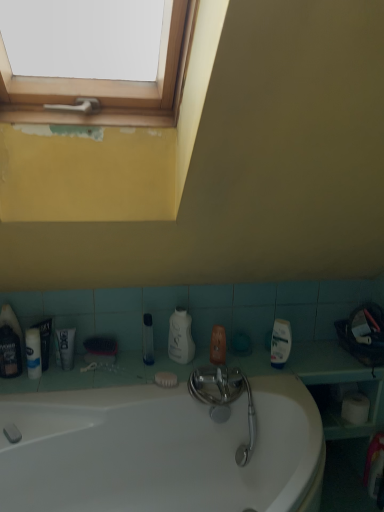
Question: From their relative heights in the image, would you say white matte soap at lower center is taller or shorter than translucent plastic mouthwash at lower left, the first mouthwash in the left-to-right sequence?

Choices:
 (A) short
 (B) tall

Answer: (A)

Question: Is white matte soap at lower center wider or thinner than translucent plastic mouthwash at lower left, marked as the 2th mouthwash in a right-to-left arrangement?

Choices:
 (A) thin
 (B) wide

Answer: (A)

Question: Which object is the closest to the clear plastic bottle at center, which ranks as the second cleaning product in right-to-left order?

Choices:
 (A) white matte soap at lower center
 (B) white matte toothpaste at lower left
 (C) white matte tube at lower left
 (D) white glossy bottle at right, the first cleaning product in the right-to-left sequence
 (E) white glossy bathtub at center

Answer: (A)

Question: Which is farther from the clear plastic tube at center, which is the second mouthwash in left-to-right order?

Choices:
 (A) translucent plastic mouthwash at lower left, marked as the 2th mouthwash in a right-to-left arrangement
 (B) wooden frame at upper left
 (C) white glossy bottle at right, the first cleaning product in the right-to-left sequence
 (D) white matte soap at lower center
 (E) white glossy bathtub at center

Answer: (B)